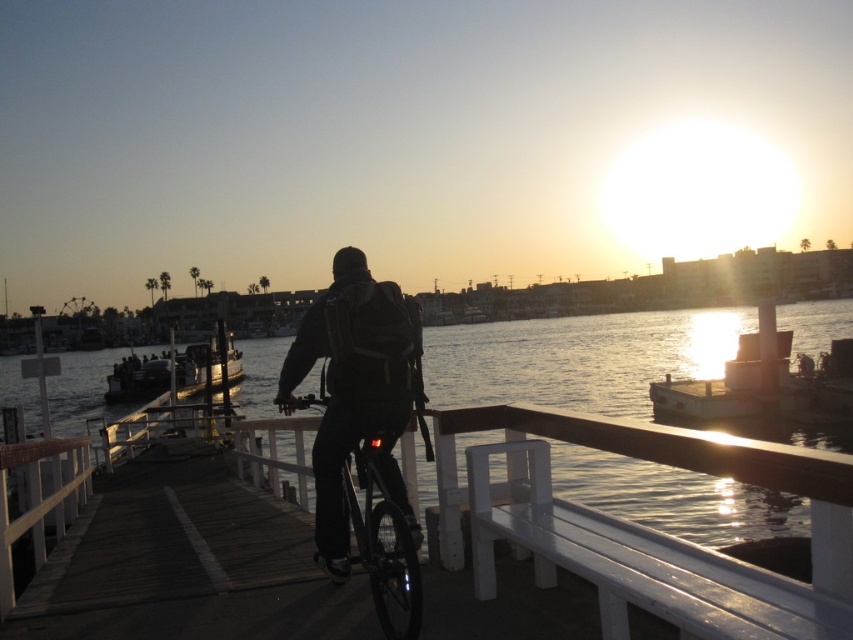
Question: Is black matte backpack at center positioned behind shiny black bicycle at center?

Choices:
 (A) yes
 (B) no

Answer: (A)

Question: Is black matte backpack at center positioned in front of shiny black bicycle at center?

Choices:
 (A) yes
 (B) no

Answer: (B)

Question: Is black matte backpack at center thinner than shiny black bicycle at center?

Choices:
 (A) yes
 (B) no

Answer: (B)

Question: Which of the following is the closest to the observer?

Choices:
 (A) (347, 531)
 (B) (402, 346)

Answer: (B)

Question: Among these points, which one is farthest from the camera?

Choices:
 (A) (416, 563)
 (B) (379, 330)

Answer: (B)